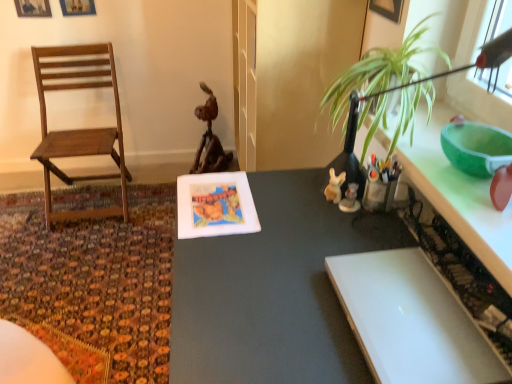
Find the location of a particular element. This screenshot has height=384, width=512. vacant space behind white matte rabbit at center-right, which ranks as the 2th toy in right-to-left order is located at coordinates (309, 180).